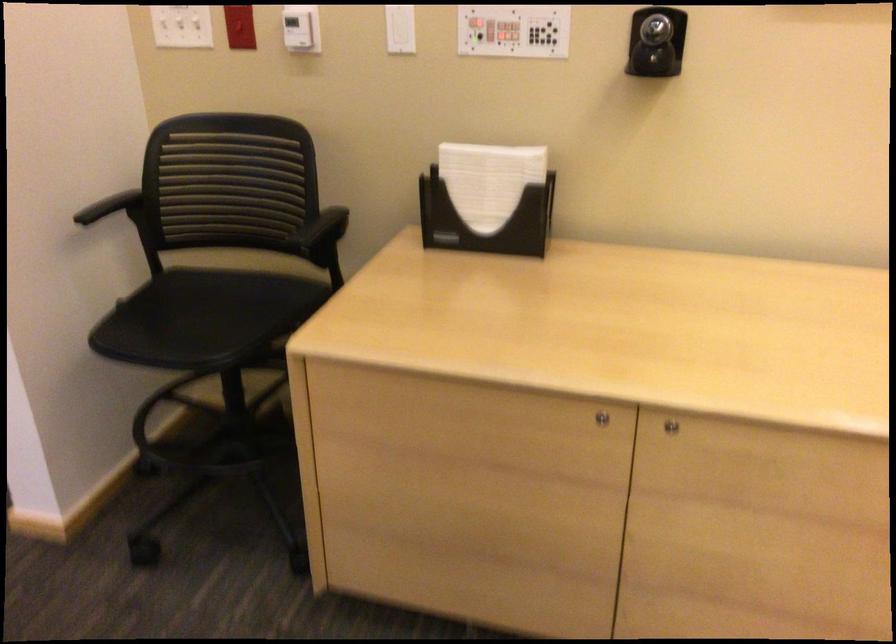
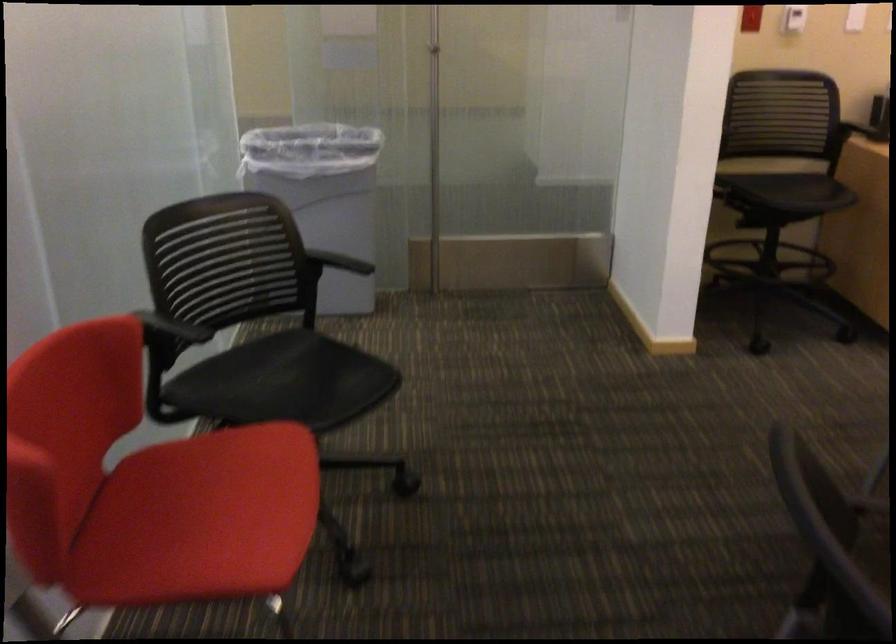
In a continuous first-person perspective shot, in which direction is the camera moving?

The cameraman walked toward left, backward.